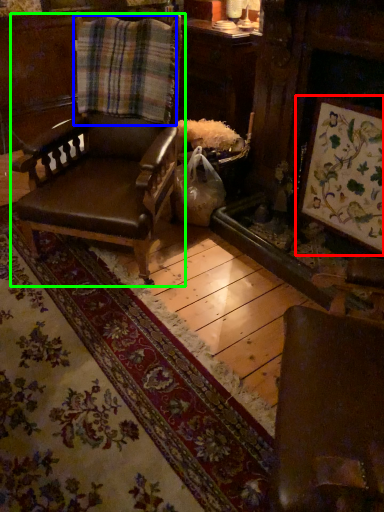
Question: Based on their relative distances, which object is nearer to picture frame (highlighted by a red box)? Choose from plaid (highlighted by a blue box) and chair (highlighted by a green box).

Choices:
 (A) plaid
 (B) chair

Answer: (B)